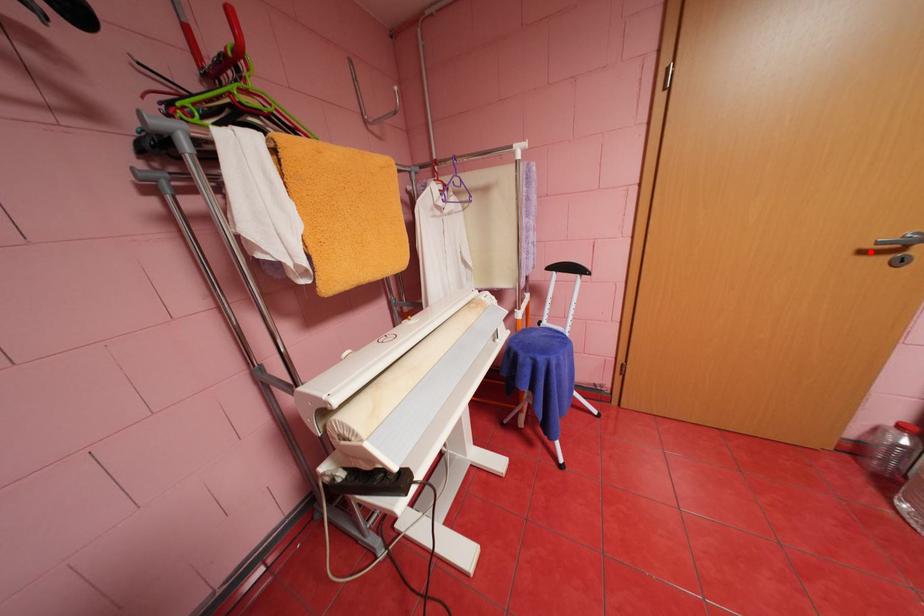
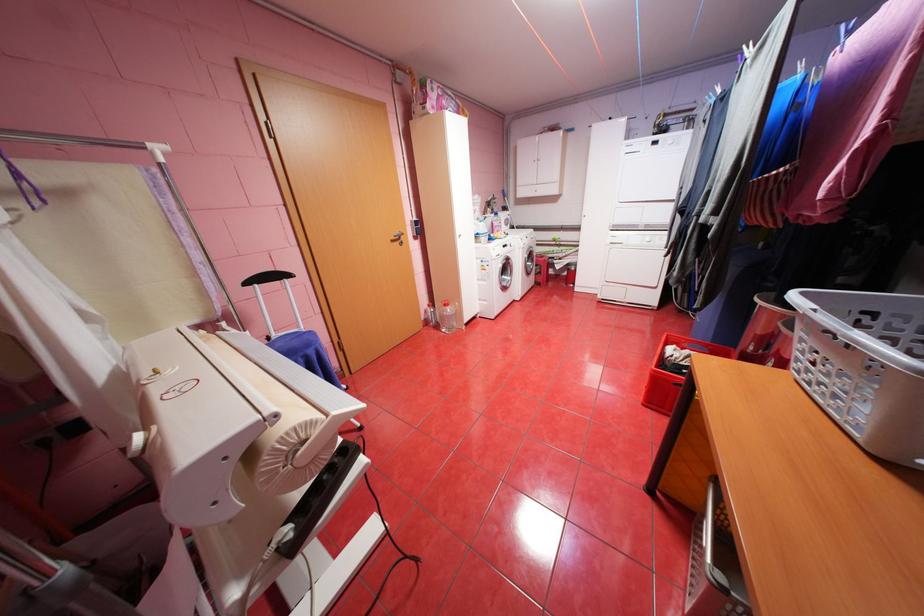
Question: I am providing you with two images of the same scene from different viewpoints. Given a red point in image1, look at the same physical point in image2. Is it:

Choices:
 (A) Closer to the viewpoint
 (B) Farther from the viewpoint

Answer: (A)